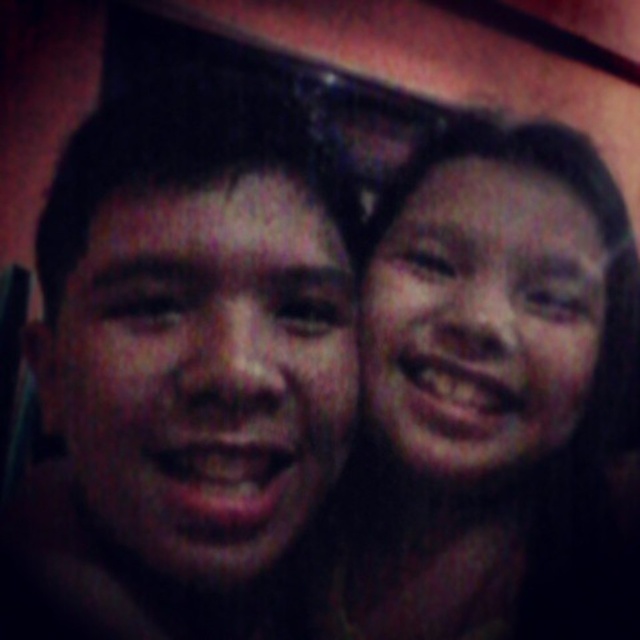
Based on the scene description, which object, the smooth skin at right or the smooth skin face at center, has a greater width?

The smooth skin at right might be wider than the smooth skin face at center according to the description.

You are a photographer trying to focus on the smooth skin at right and the smooth skin face at right in the image. Which one is closer to you?

The smooth skin at right is closer to the viewer than the smooth skin face at right.

You are a photographer trying to adjust the lighting for a portrait. You have two subjects with smooth skin faces in the frame. The smooth skin face at center and the smooth skin face at right. Which subject should you adjust the lighting for if you want to ensure both faces are evenly illuminated, considering their sizes?

The smooth skin face at center is smaller than the smooth skin face at right. To ensure even illumination, adjust the lighting for the smooth skin face at center to compensate for its smaller size.